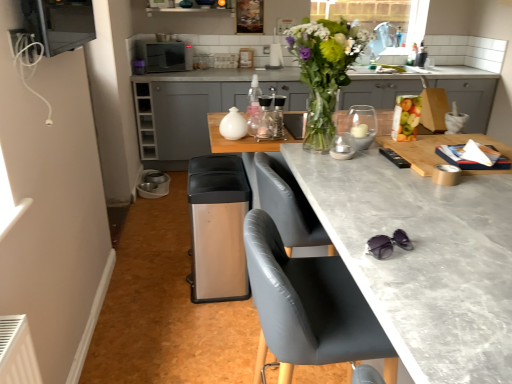
This screenshot has height=384, width=512. In order to click on free point to the right of translucent glass candle holder at center, marked as the 2th appliance in a bottom-to-top arrangement in this screenshot , I will do `click(387, 149)`.